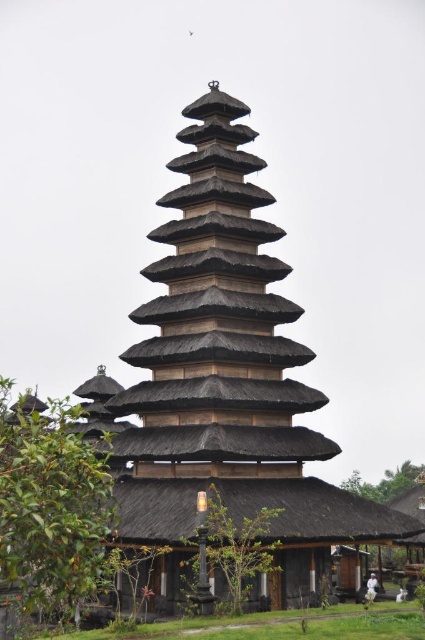
You are standing at the entrance of the temple and see the point marked at coordinates (51, 502). What is located at that point?

The point at coordinates (51, 502) is occupied by a green leafy tree at lower left.

Based on the photo, you are a visitor at the Balinese temple and want to take a photo that includes both the green leafy tree at center and the green leafy tree at lower right. Given that your camera has a maximum zoom range of 50 meters, will you be able to capture both trees in a single frame without moving your position?

The distance between the green leafy tree at center and the green leafy tree at lower right is 52.04 meters. Since your camera can only zoom up to 50 meters, you won cannot capture both trees in a single frame without moving your position.